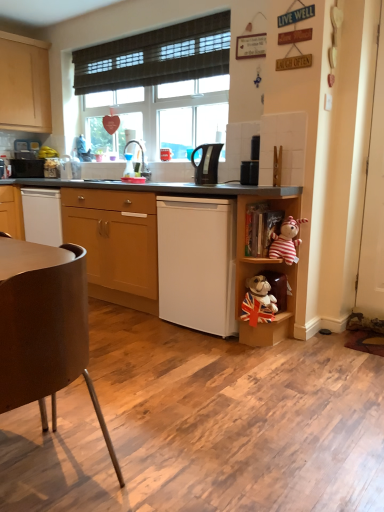
Question: Relative to transparent plastic sink at center, which appears as the 2th appliance when viewed from the back, is brown matte chair at lower left in front or behind?

Choices:
 (A) front
 (B) behind

Answer: (A)

Question: Is brown matte chair at lower left bigger or smaller than transparent plastic sink at center, the second appliance viewed from the right?

Choices:
 (A) small
 (B) big

Answer: (B)

Question: Which object is positioned closest to the white matte dishwasher at center?

Choices:
 (A) brown woven curtain at upper center
 (B) white glossy kettle at upper center, the first appliance from the back
 (C) white plastic shelf at lower right, marked as the first shelf in a bottom-to-top arrangement
 (D) wooden shelf at right, the second shelf from the bottom
 (E) brown matte chair at lower left

Answer: (D)

Question: Estimate the real-world distances between objects in this image. Which object is farther from the black plastic kettle at center?

Choices:
 (A) brown matte chair at lower left
 (B) matte wood cabinet at center
 (C) transparent plastic sink at center, which appears as the 2th appliance when viewed from the back
 (D) striped fabric monkey at right
 (E) wooden bookshelf at center-right, arranged as the first shelf when viewed from the top

Answer: (A)